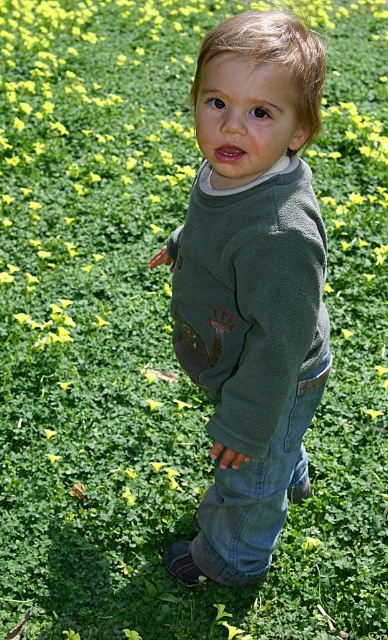
You are a tailor measuring the distance between the green matte sweater at center and the jeans at lower center for a custom outfit. The minimum required distance between these items for proper fitting is 6 inches. Can the current distance accommodate the fitting requirement?

The green matte sweater at center is 6.54 inches from the jeans at lower center, which exceeds the minimum required distance of 6 inches. Therefore, the current distance can accommodate the fitting requirement.

You are a photographer setting up a shot of the child in the field. You want to ensure the green matte sweater at center and the jeans at lower center are both in focus. Since the sweater is to the left of the jeans, where should you position the focus point to capture both effectively?

The green matte sweater at center is to the left of the jeans at lower center. To ensure both are in focus, position the focus point between them, slightly favoring the sweater since it is closer to the left edge.

You are a drone operator trying to capture a photo of the child in the scene. You have two points marked on your screen for positioning the drone. The first point is at coordinates point (320,387) and the second point is at coordinates point (207,493). Which point should you choose to ensure the drone is closer to the child?

Point (320,387) is in front of point (207,493), so choosing point (320,387) will place the drone closer to the child.